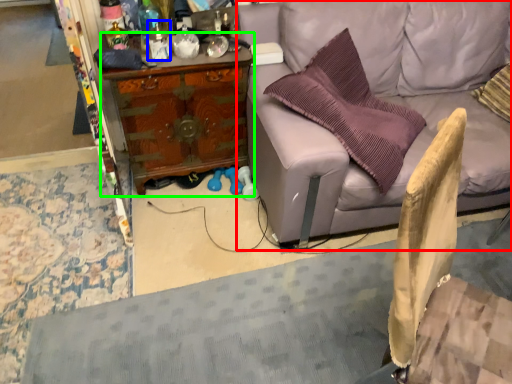
Question: Which is farther away from studio couch (highlighted by a red box)? bottle (highlighted by a blue box) or desk (highlighted by a green box)?

Choices:
 (A) bottle
 (B) desk

Answer: (A)